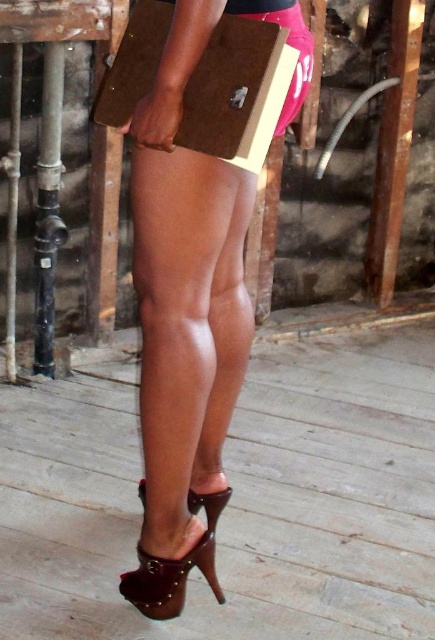
Question: Does satin brown clutch at center appear on the right side of matte brown cardboard box at center?

Choices:
 (A) no
 (B) yes

Answer: (B)

Question: Is satin brown clutch at center thinner than matte brown cardboard box at center?

Choices:
 (A) yes
 (B) no

Answer: (A)

Question: Is matte brown cardboard box at center behind brown leather sandal at lower center?

Choices:
 (A) no
 (B) yes

Answer: (A)

Question: Based on their relative distances, which object is nearer to the satin brown clutch at center?

Choices:
 (A) matte brown cardboard box at center
 (B) brown leather sandal at lower center

Answer: (A)

Question: Which is nearer to the brown leather sandal at lower center?

Choices:
 (A) satin brown clutch at center
 (B) matte brown cardboard box at center

Answer: (A)

Question: Which of the following is the closest to the observer?

Choices:
 (A) (217, 492)
 (B) (295, 108)
 (C) (264, 93)

Answer: (C)